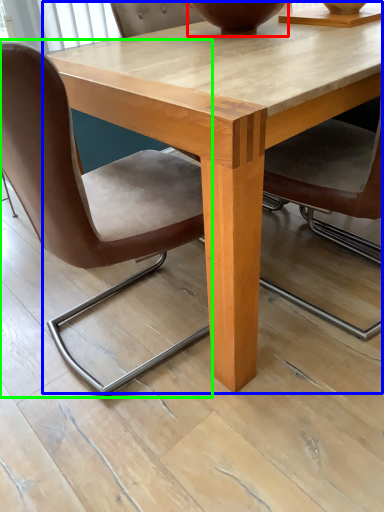
Question: Based on their relative distances, which object is nearer to vase (highlighted by a red box)? Choose from coffee table (highlighted by a blue box) and chair (highlighted by a green box).

Choices:
 (A) coffee table
 (B) chair

Answer: (A)